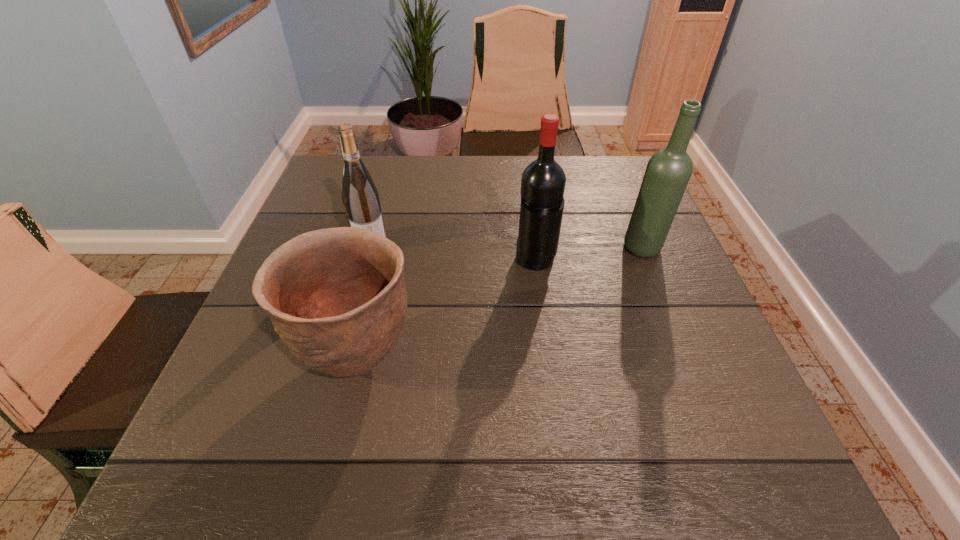
Point out which wine bottle is positioned as the nearest to the second wine bottle from right to left. Please provide its 2D coordinates. Your answer should be formatted as a tuple, i.e. [(x, y)], where the tuple contains the x and y coordinates of a point satisfying the conditions above.

[(668, 171)]

At what (x,y) coordinates should I click in order to perform the action: click on vacant space that satisfies the following two spatial constraints: 1. on the front side of the rightmost wine bottle; 2. on the right side of the shortest wine bottle. Please return your answer as a coordinate pair (x, y). Looking at the image, I should click on (370, 248).

Where is `free location that satisfies the following two spatial constraints: 1. on the front side of the second object from right to left; 2. on the right side of the leftmost wine bottle`? The image size is (960, 540). free location that satisfies the following two spatial constraints: 1. on the front side of the second object from right to left; 2. on the right side of the leftmost wine bottle is located at coordinates (366, 261).

The image size is (960, 540). Identify the location of vacant space that satisfies the following two spatial constraints: 1. on the front side of the rightmost object; 2. on the right side of the leftmost wine bottle. (370, 248).

Identify the location of vacant area in the image that satisfies the following two spatial constraints: 1. on the front side of the third tallest object; 2. on the right side of the second wine bottle from right to left. This screenshot has height=540, width=960. (366, 261).

Locate an element on the screen. This screenshot has width=960, height=540. vacant region that satisfies the following two spatial constraints: 1. on the front side of the rightmost wine bottle; 2. on the right side of the shortest wine bottle is located at coordinates (370, 248).

Find the location of a particular element. The width and height of the screenshot is (960, 540). free space that satisfies the following two spatial constraints: 1. on the front side of the rightmost object; 2. on the right side of the third tallest object is located at coordinates (370, 248).